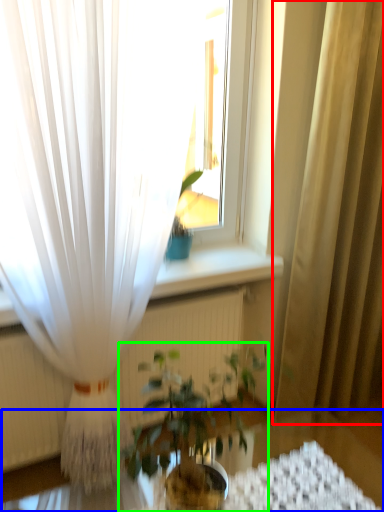
Question: Considering the real-world distances, which object is farthest from curtain (highlighted by a red box)? round table (highlighted by a blue box) or houseplant (highlighted by a green box)?

Choices:
 (A) round table
 (B) houseplant

Answer: (B)